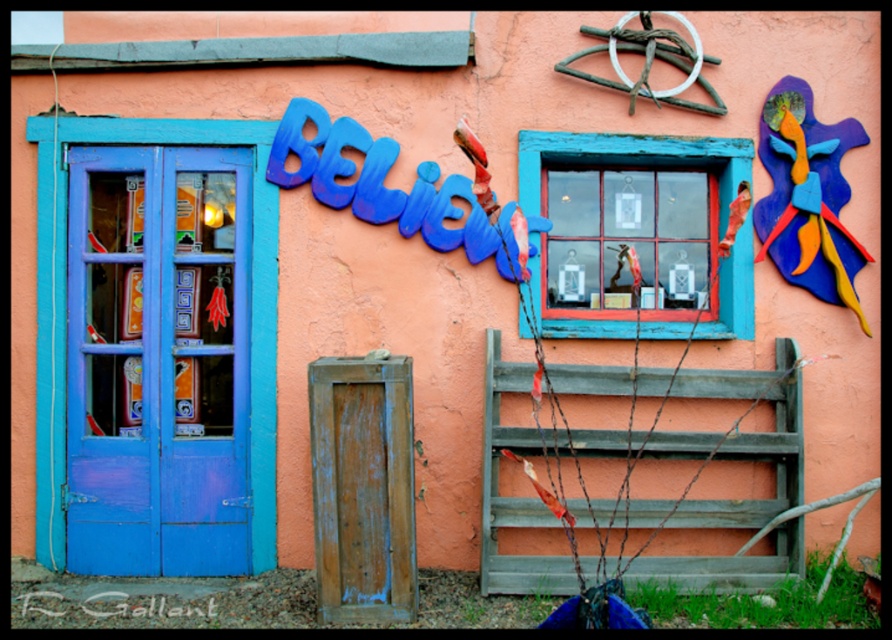
Question: Is blue painted wood door at left thinner than wooden window at center?

Choices:
 (A) yes
 (B) no

Answer: (A)

Question: Among these objects, which one is farthest from the camera?

Choices:
 (A) wooden window at center
 (B) blue painted wood door at left

Answer: (B)

Question: Is blue painted wood door at left positioned at the back of wooden window at center?

Choices:
 (A) yes
 (B) no

Answer: (A)

Question: Can you confirm if blue painted wood door at left is positioned below wooden window at center?

Choices:
 (A) no
 (B) yes

Answer: (B)

Question: Which of the following is the farthest from the observer?

Choices:
 (A) wooden window at center
 (B) blue painted wood door at left

Answer: (B)